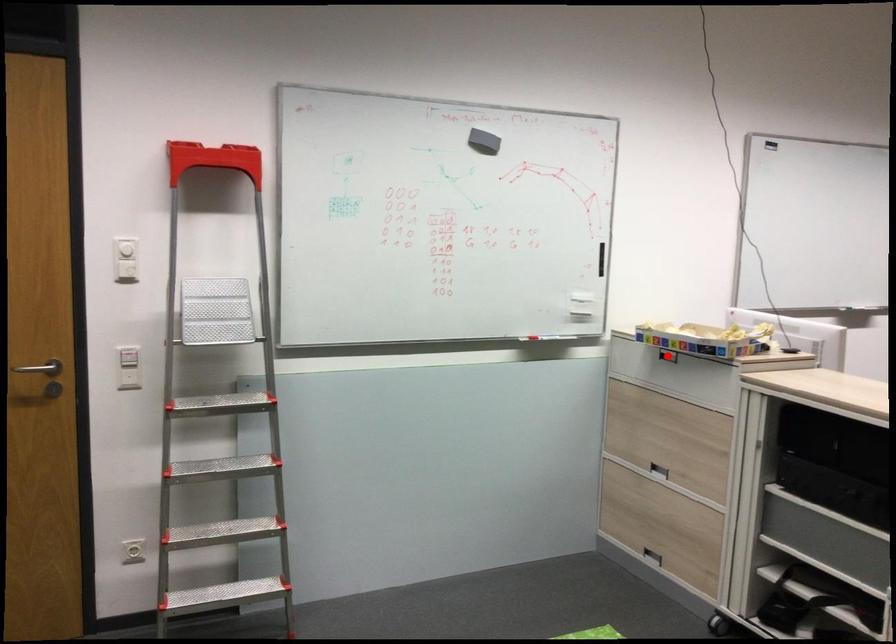
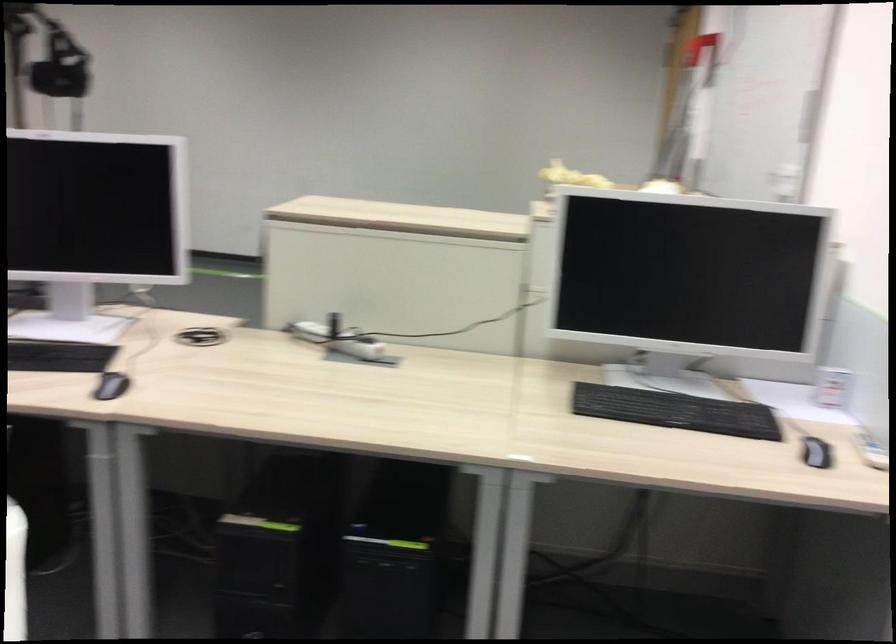
Question: I am providing you with two images of the same scene from different viewpoints. A red point is marked on the first image. Can you still see the location of the red point in image 2?

Choices:
 (A) Yes
 (B) No

Answer: (B)